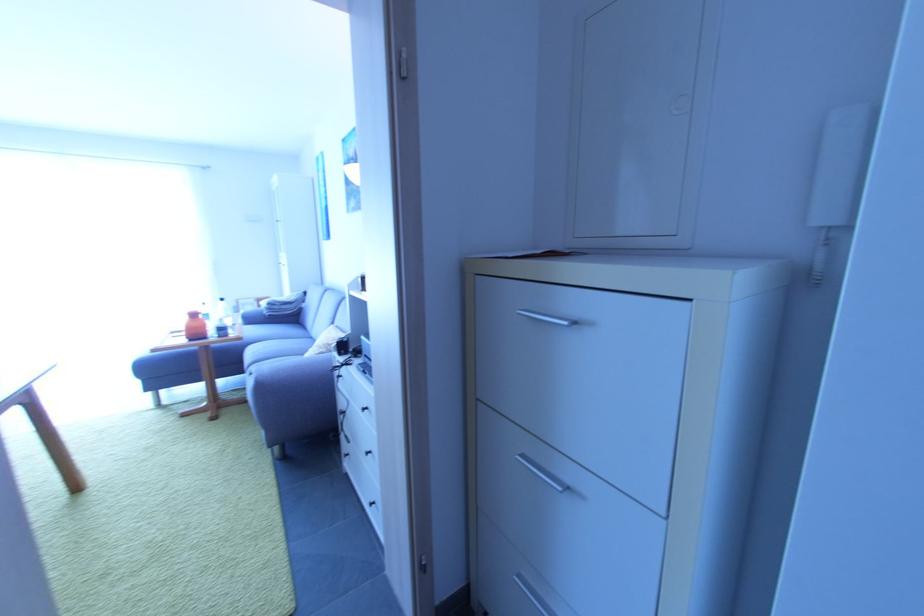
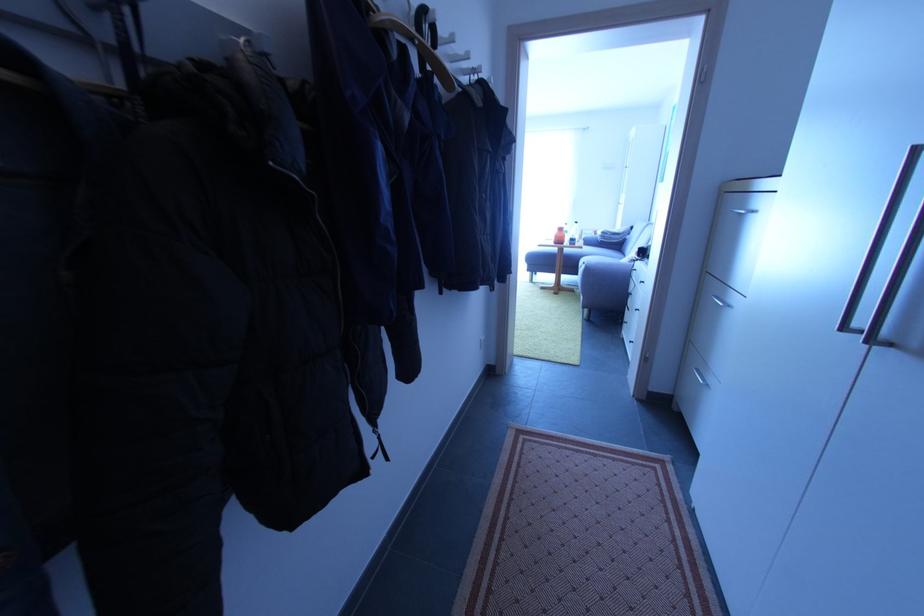
Find the pixel in the second image that matches the point at 188,331 in the first image.

(557, 238)